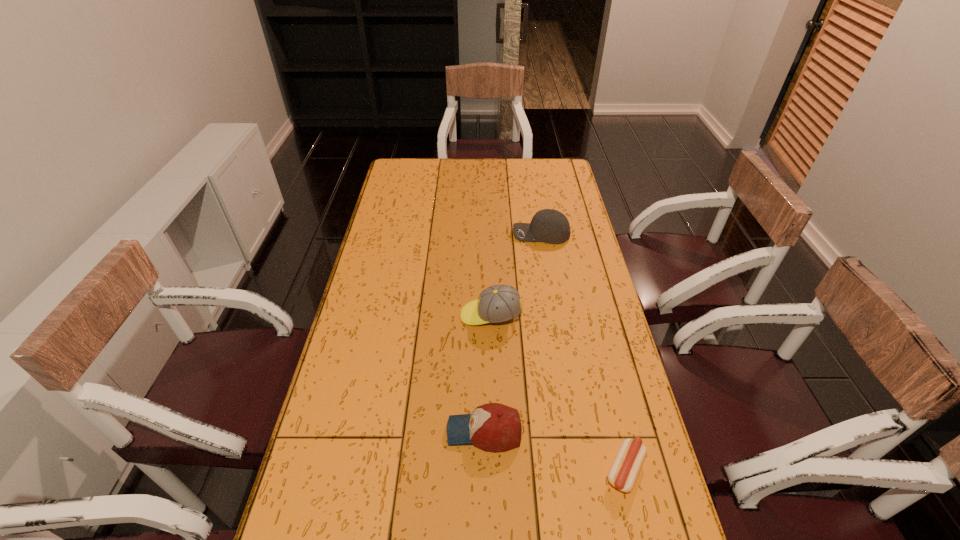
The width and height of the screenshot is (960, 540). Identify the location of vacant space that satisfies the following two spatial constraints: 1. on the back side of the sausage; 2. on the front-facing side of the second farthest object. (588, 315).

This screenshot has width=960, height=540. In order to click on vacant space that satisfies the following two spatial constraints: 1. on the front-facing side of the sausage; 2. on the left side of the shortest baseball cap in this screenshot , I will do `click(485, 470)`.

The height and width of the screenshot is (540, 960). Identify the location of vacant area that satisfies the following two spatial constraints: 1. on the front-facing side of the shortest object; 2. on the left side of the second farthest baseball cap. (494, 470).

Locate an element on the screen. free space in the image that satisfies the following two spatial constraints: 1. on the front-facing side of the third nearest object; 2. on the right side of the sausage is located at coordinates (494, 470).

Locate an element on the screen. The height and width of the screenshot is (540, 960). blank space that satisfies the following two spatial constraints: 1. on the front brim of the farthest object; 2. on the back side of the shortest object is located at coordinates (581, 470).

Identify the location of free region that satisfies the following two spatial constraints: 1. on the front-facing side of the shortest object; 2. on the right side of the second shortest object. The image size is (960, 540). (485, 470).